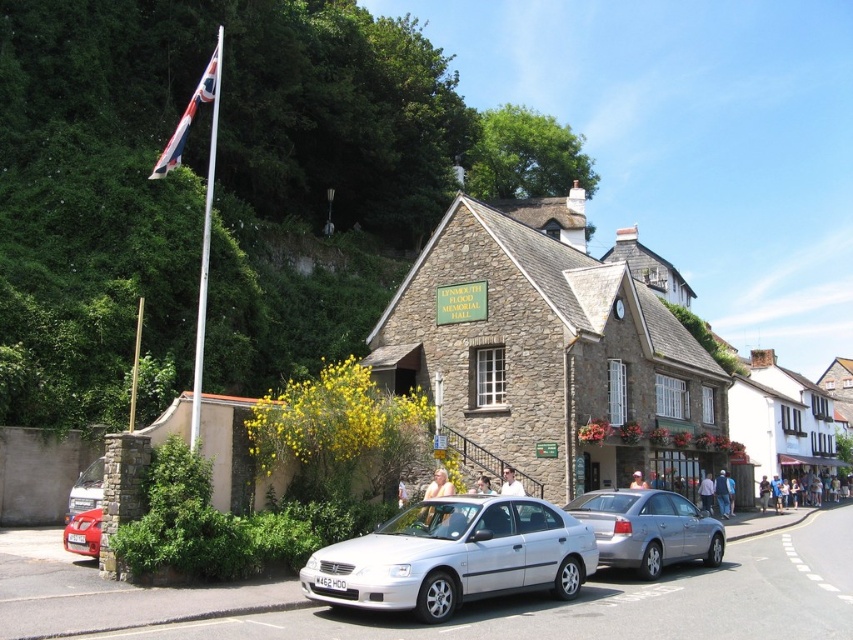
You are a delivery driver who needs to park your van, which is 2 meters wide, in the parking area near Lyndmouth Place Memorial Hall. There are two silver metallic cars parked here. Can you fit your van between the silver metallic car at center and the silver metallic car at lower left?

The silver metallic car at center is wider than the silver metallic car at lower left. However, the combined width of both cars would need to be considered to determine if there is enough space. Since the exact distance between them isn

You are a pedestrian standing at the entrance of Lyndmouth Place Memorial Hall. You need to cross the street to reach a bench located behind the silver metallic car at lower left. The road is 15 meters wide. Can you safely cross the road before the silver metallic sedan at center arrives, assuming it is moving towards you at 5 meters per second?

The silver metallic sedan at center is 27.15 meters away from the silver metallic car at lower left. Since the road is 15 meters wide, the sedan would need to cover 27.15 meters to reach the car. At 5 meters per second, it would take approximately 5.43 seconds to arrive. To cross the 15 meter road, a pedestrian walking at 1.5 meters per second would take 10 seconds. Therefore, the pedestrian cannot safely cross before the sedan arrives.

From the picture: You are a pedestrian standing at the entrance of Lyndmouth Place Memorial Hall. You see a silver metallic sedan at center and a silver metallic car at lower left. Which car is closer to you?

The silver metallic sedan at center is closer to you because it is located below the silver metallic car at lower left, meaning it is positioned lower in the image and thus nearer from your perspective.